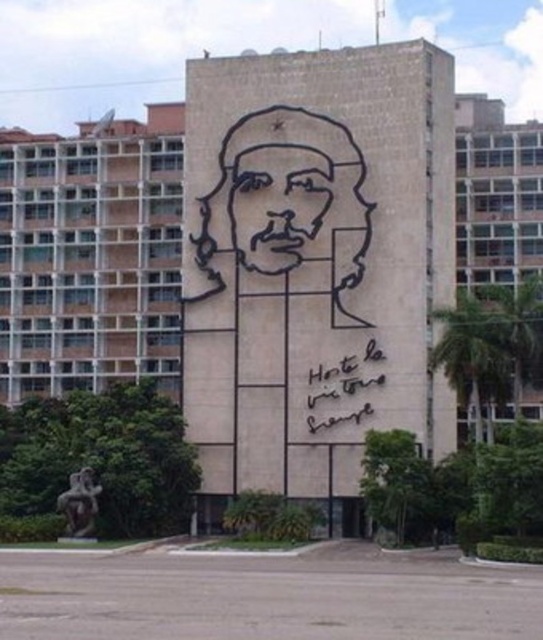
You are an art student who wants to sketch the black wire sculpture at center and the black calligraphy at lower right. Which object should you focus on first if you want to draw the wider one?

The black wire sculpture at center might be wider than black calligraphy at lower right, so you should focus on the black wire sculpture at center first.